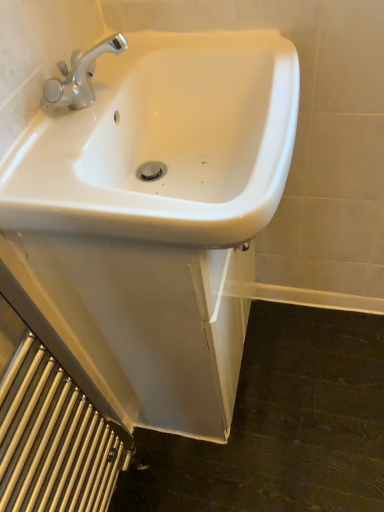
At what (x,y) coordinates should I click in order to perform the action: click on silver metallic radiator at lower left. Please return your answer as a coordinate pair (x, y). The image size is (384, 512). Looking at the image, I should click on (54, 441).

Measure the distance between silver metallic radiator at lower left and camera.

silver metallic radiator at lower left and camera are 23.56 inches apart.

Describe the element at coordinates (54, 441) in the screenshot. I see `silver metallic radiator at lower left` at that location.

Describe the element at coordinates (164, 143) in the screenshot. The width and height of the screenshot is (384, 512). I see `white glossy sink at center` at that location.

Where is `white glossy sink at center`? This screenshot has width=384, height=512. white glossy sink at center is located at coordinates [x=164, y=143].

Identify the location of silver metallic radiator at lower left. The height and width of the screenshot is (512, 384). (54, 441).

Considering the positions of objects silver metallic radiator at lower left and white glossy sink at center in the image provided, who is more to the left, silver metallic radiator at lower left or white glossy sink at center?

From the viewer's perspective, silver metallic radiator at lower left appears more on the left side.

Is silver metallic radiator at lower left closer to camera compared to white glossy sink at center?

Yes, it is in front of white glossy sink at center.

Is point (101, 450) closer or farther from the camera than point (78, 212)?

Clearly, point (101, 450) is more distant from the camera than point (78, 212).

From the image's perspective, which object appears higher, silver metallic radiator at lower left or white glossy sink at center?

white glossy sink at center appears higher in the image.

From a real-world perspective, is silver metallic radiator at lower left on white glossy sink at center?

No, from a real-world perspective, silver metallic radiator at lower left is not over white glossy sink at center

Which of these two, silver metallic radiator at lower left or white glossy sink at center, is wider?

With larger width is white glossy sink at center.

Does silver metallic radiator at lower left have a greater height compared to white glossy sink at center?

Correct, silver metallic radiator at lower left is much taller as white glossy sink at center.

Can you confirm if silver metallic radiator at lower left is smaller than white glossy sink at center?

Indeed, silver metallic radiator at lower left has a smaller size compared to white glossy sink at center.

Can we say silver metallic radiator at lower left lies outside white glossy sink at center?

silver metallic radiator at lower left is positioned outside white glossy sink at center.

Is silver metallic radiator at lower left placed right next to white glossy sink at center?

No, silver metallic radiator at lower left is not in contact with white glossy sink at center.

Is silver metallic radiator at lower left facing towards white glossy sink at center?

No, silver metallic radiator at lower left does not turn towards white glossy sink at center.

Can you tell me how much silver metallic radiator at lower left and white glossy sink at center differ in facing direction?

The angle between the facing direction of silver metallic radiator at lower left and the facing direction of white glossy sink at center is 0.783 degrees.

Measure the distance between silver metallic radiator at lower left and white glossy sink at center.

silver metallic radiator at lower left and white glossy sink at center are 17.82 inches apart.

Identify the location of sink behind the silver metallic radiator at lower left. (164, 143).

Would you say white glossy sink at center is to the left or to the right of silver metallic radiator at lower left in the picture?

In the image, white glossy sink at center appears on the right side of silver metallic radiator at lower left.

Between white glossy sink at center and silver metallic radiator at lower left, which one is positioned behind?

white glossy sink at center is further away from the camera.

Which is closer, (72,132) or (40,502)?

Point (72,132) is closer to the camera than point (40,502).

From the image's perspective, is white glossy sink at center on top of silver metallic radiator at lower left?

Indeed, from the image's perspective, white glossy sink at center is shown above silver metallic radiator at lower left.

From a real-world perspective, is white glossy sink at center positioned above or below silver metallic radiator at lower left?

From a real-world perspective, white glossy sink at center is physically above silver metallic radiator at lower left.

In terms of width, does white glossy sink at center look wider or thinner when compared to silver metallic radiator at lower left?

white glossy sink at center is wider than silver metallic radiator at lower left.

In terms of height, does white glossy sink at center look taller or shorter compared to silver metallic radiator at lower left?

Clearly, white glossy sink at center is shorter compared to silver metallic radiator at lower left.

Can you confirm if white glossy sink at center is smaller than silver metallic radiator at lower left?

Incorrect, white glossy sink at center is not smaller in size than silver metallic radiator at lower left.

Do you think white glossy sink at center is within silver metallic radiator at lower left, or outside of it?

white glossy sink at center is spatially situated outside silver metallic radiator at lower left.

Are white glossy sink at center and silver metallic radiator at lower left located far from each other?

white glossy sink at center is near silver metallic radiator at lower left, not far away.

Does white glossy sink at center turn towards silver metallic radiator at lower left?

No, white glossy sink at center is not turned towards silver metallic radiator at lower left.

The width and height of the screenshot is (384, 512). I want to click on radiator below the white glossy sink at center (from the image's perspective), so click(54, 441).

I want to click on radiator below the white glossy sink at center (from a real-world perspective), so click(54, 441).

Locate an element on the screen. The width and height of the screenshot is (384, 512). sink that appears above the silver metallic radiator at lower left (from the image's perspective) is located at coordinates (164, 143).